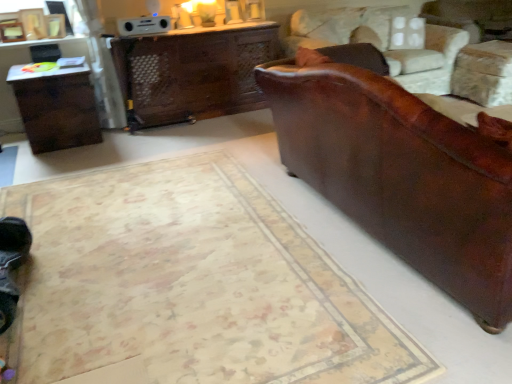
The image size is (512, 384). What are the coordinates of `unoccupied region to the right of dark brown wood table at left` in the screenshot? It's located at (120, 145).